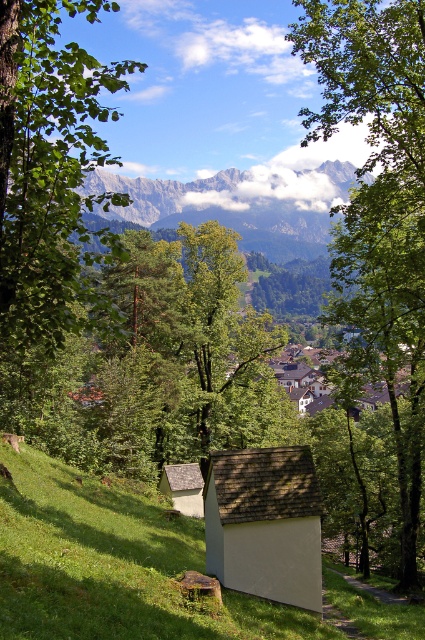
You are standing on the hillside looking at the scene. Which object is closer to you, the green leafy tree at center or the green grassy at lower left?

The green leafy tree at center is closer to you because the green grassy at lower left is behind it.

You are standing on the hillside and looking at the green grassy at lower left and the green leafy tree at left. Which object is closer to the left edge of the image?

The green leafy tree at left is closer to the left edge of the image because the green grassy at lower left is positioned on the right side of it.